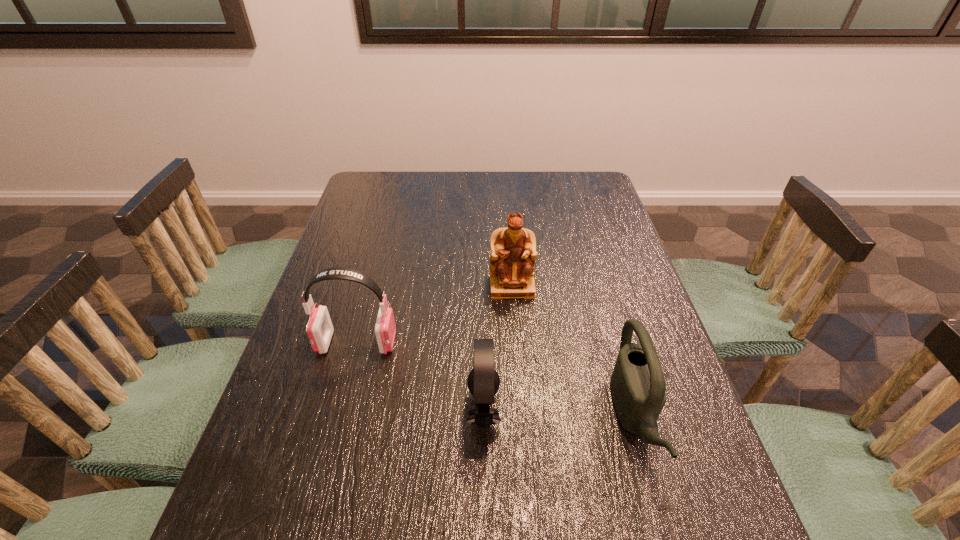
At what (x,y) coordinates should I click in order to perform the action: click on vacant space located on the ear cups of the right earphone. Please return your answer as a coordinate pair (x, y). The width and height of the screenshot is (960, 540). Looking at the image, I should click on (311, 409).

Identify the location of blank space located 0.320m on the spout of the watering can. The image size is (960, 540). (463, 417).

Identify the location of free point located on the spout of the watering can. The image size is (960, 540). (572, 417).

You are a GUI agent. You are given a task and a screenshot of the screen. Output one action in this format:
    pyautogui.click(x=<x>, y=<y>)
    Task: Click on the free space located 0.300m on the spout of the watering can
    The width and height of the screenshot is (960, 540).
    Given the screenshot: What is the action you would take?
    pyautogui.click(x=472, y=417)

At what (x,y) coordinates should I click in order to perform the action: click on object present at the left edge. Please return your answer as a coordinate pair (x, y). Looking at the image, I should click on (319, 329).

This screenshot has height=540, width=960. Identify the location of object that is at the right edge. [637, 383].

In the image, there is a desktop. Where is `free region at the far edge`? This screenshot has width=960, height=540. free region at the far edge is located at coordinates (488, 191).

The height and width of the screenshot is (540, 960). Identify the location of free space at the left edge. (390, 211).

In the image, there is a desktop. Identify the location of vacant space at the right edge. (612, 296).

Find the location of a particular element. This screenshot has height=540, width=960. vacant space at the far left corner of the desktop is located at coordinates (378, 199).